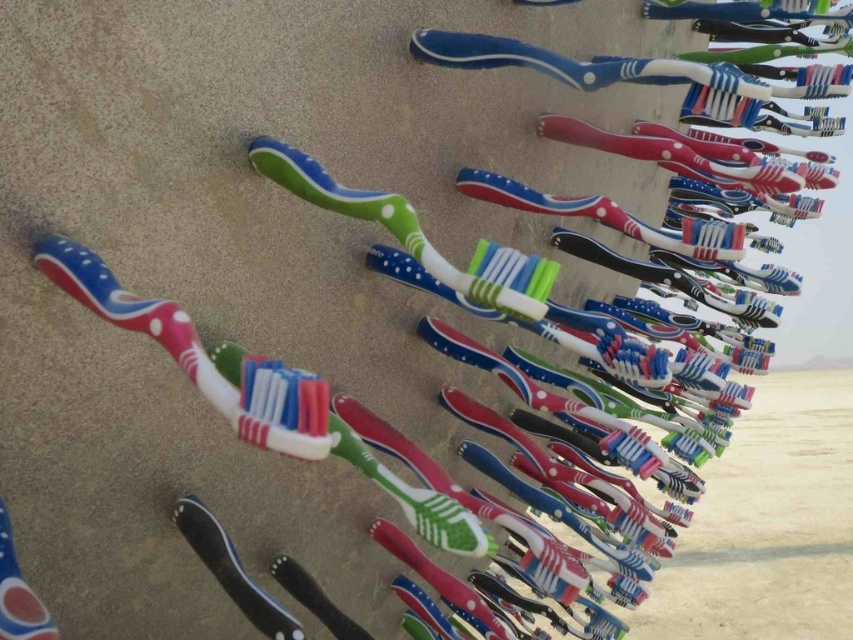
Question: Which object is farther from the camera taking this photo?

Choices:
 (A) matte plastic toothpaste at lower left
 (B) matte plastic toothbrush at center
 (C) blue glossy toothbrush at upper right

Answer: (C)

Question: Does matte plastic toothbrush at center have a larger size compared to matte plastic toothpaste at lower left?

Choices:
 (A) yes
 (B) no

Answer: (A)

Question: Is matte plastic toothbrush at center positioned behind blue glossy toothbrush at upper right?

Choices:
 (A) no
 (B) yes

Answer: (A)

Question: Among these objects, which one is nearest to the camera?

Choices:
 (A) matte plastic toothpaste at lower left
 (B) blue glossy toothbrush at upper right
 (C) matte plastic toothbrush at center

Answer: (C)

Question: Which is nearer to the matte plastic toothbrush at center?

Choices:
 (A) matte plastic toothpaste at lower left
 (B) blue glossy toothbrush at upper right

Answer: (A)

Question: Is blue glossy toothbrush at upper right thinner than matte plastic toothpaste at lower left?

Choices:
 (A) yes
 (B) no

Answer: (B)